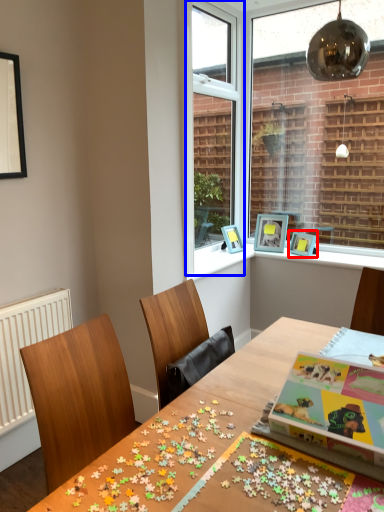
Question: Which object appears closest to the camera in this image, picture frame (highlighted by a red box) or window frame (highlighted by a blue box)?

Choices:
 (A) picture frame
 (B) window frame

Answer: (B)